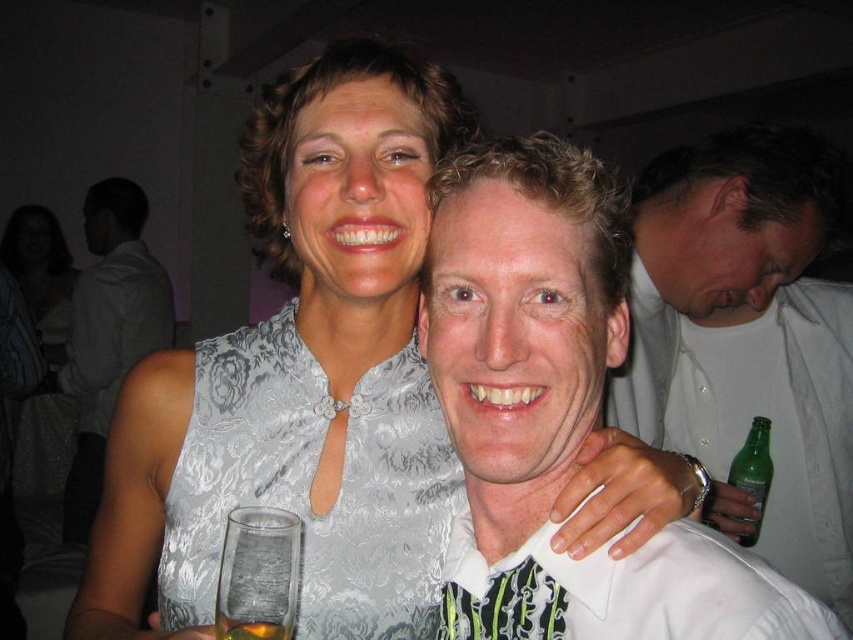
You are a photographer at a party and need to position two guests wearing the white satin dress at center and the matte white dress at upper center so that they both fit comfortably in the frame. Based on their dress widths, which guest should be placed closer to the edge of the frame?

The guest wearing the white satin dress at center should be placed closer to the edge of the frame since it has a lesser width compared to the matte white dress at upper center, allowing more space for the wider dress in the center.

You are a photographer at the event and need to capture a clear shot of both the white satin dress at center and the matte white dress at upper center. Which dress will appear larger in the photo?

The white satin dress at center will appear larger in the photo because it is closer to the viewer than the matte white dress at upper center.

You are a photographer at the event and need to ensure that both the white satin dress at center and the clear glass at center are visible in the photo. Given their sizes, which object should you focus on first to ensure proper framing?

The white satin dress at center has a greater height compared to the clear glass at center, so you should focus on the white satin dress at center first to ensure proper framing as it is taller and might require more attention in the composition.